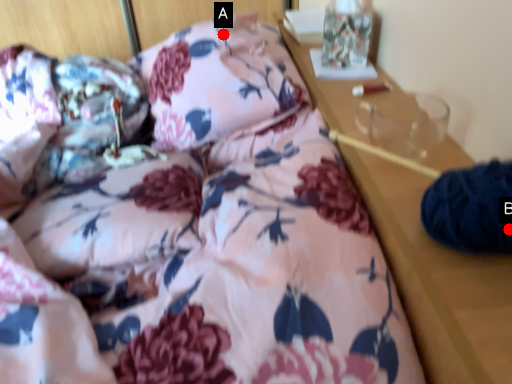
Question: Two points are circled on the image, labeled by A and B beside each circle. Among these points, which one is nearest to the camera?

Choices:
 (A) A is closer
 (B) B is closer

Answer: (B)